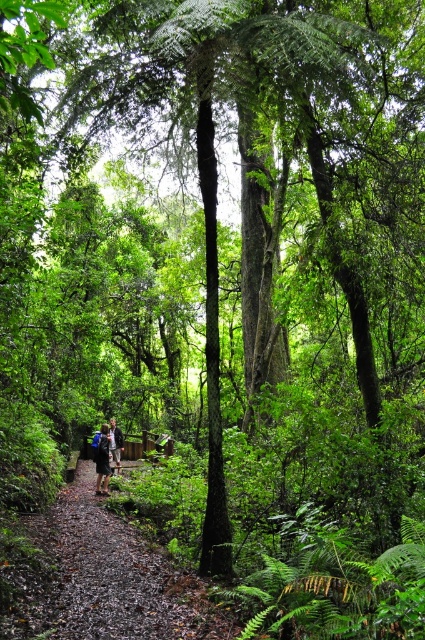
Question: Is brown dirt path at center closer to the viewer compared to dark blue jacket at center?

Choices:
 (A) no
 (B) yes

Answer: (B)

Question: Can you confirm if blue fabric backpack at center is bigger than dark blue jacket at center?

Choices:
 (A) yes
 (B) no

Answer: (B)

Question: Is brown dirt path at center above dark blue jacket at center?

Choices:
 (A) yes
 (B) no

Answer: (A)

Question: Among these points, which one is nearest to the camera?

Choices:
 (A) (113, 422)
 (B) (209, 634)
 (C) (101, 440)

Answer: (B)

Question: Which of the following is the closest to the observer?

Choices:
 (A) blue fabric backpack at center
 (B) dark blue jacket at center
 (C) brown dirt path at center

Answer: (C)

Question: Which object is the closest to the brown dirt path at center?

Choices:
 (A) dark blue jacket at center
 (B) blue fabric backpack at center

Answer: (A)